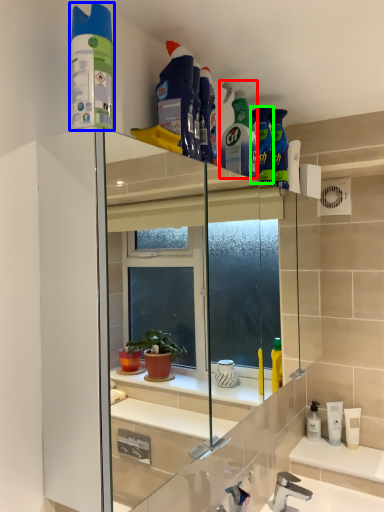
Question: Based on their relative distances, which object is farther from cleaning product (highlighted by a red box)? Choose from cleaning product (highlighted by a blue box) and cleaning product (highlighted by a green box).

Choices:
 (A) cleaning product
 (B) cleaning product

Answer: (A)